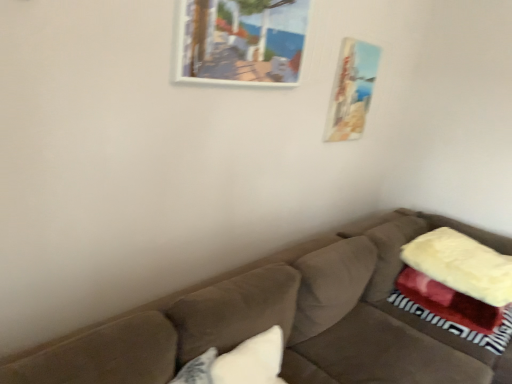
Question: Is point (353, 135) positioned closer to the camera than point (280, 69)?

Choices:
 (A) farther
 (B) closer

Answer: (A)

Question: Considering their positions, is matte wooden picture frame at upper right, the second picture frame in the left-to-right sequence, located in front of or behind wooden picture frame at upper center, the 2th picture frame in the back-to-front sequence?

Choices:
 (A) behind
 (B) front

Answer: (A)

Question: Estimate the real-world distances between objects in this image. Which object is closer to the wooden picture frame at upper center, placed as the first picture frame when sorted from front to back?

Choices:
 (A) white soft pillow at lower center
 (B) matte wooden picture frame at upper right, the second picture frame in the left-to-right sequence
 (C) suede brown couch at center

Answer: (B)

Question: Considering the real-world distances, which object is closest to the white soft pillow at lower center?

Choices:
 (A) matte wooden picture frame at upper right, the second picture frame in the left-to-right sequence
 (B) wooden picture frame at upper center, placed as the first picture frame when sorted from front to back
 (C) suede brown couch at center

Answer: (C)